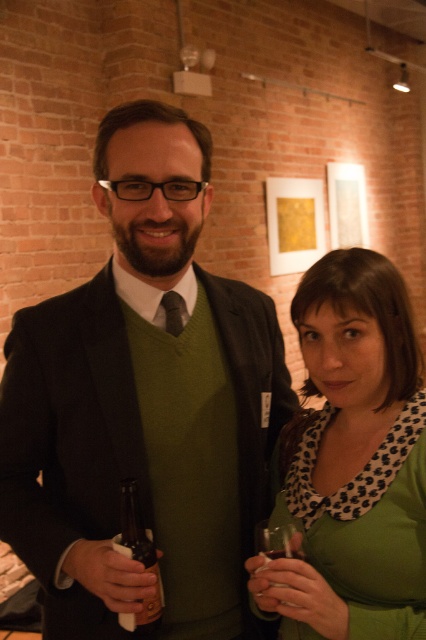
Is green matte sweater at center taller than clear glass at right?

Indeed, green matte sweater at center has a greater height compared to clear glass at right.

Does green matte sweater at center have a lesser width compared to clear glass at right?

No.

Locate an element on the screen. Image resolution: width=426 pixels, height=640 pixels. green matte sweater at center is located at coordinates (143, 403).

You are a GUI agent. You are given a task and a screenshot of the screen. Output one action in this format:
    pyautogui.click(x=<x>, y=<y>)
    Task: Click on the green matte sweater at center
    This screenshot has height=640, width=426.
    Given the screenshot: What is the action you would take?
    pyautogui.click(x=143, y=403)

Can you confirm if matte green blouse at center is smaller than clear glass at right?

No, matte green blouse at center is not smaller than clear glass at right.

Find the location of a particular element. matte green blouse at center is located at coordinates (354, 460).

Who is more distant from viewer, (386, 496) or (287, 602)?

The point (386, 496) is more distant.

Find the location of `matte green blouse at center`. matte green blouse at center is located at coordinates click(354, 460).

Which is above, green matte sweater at center or matte green blouse at center?

green matte sweater at center

Which is behind, point (239, 298) or point (406, 625)?

The point (239, 298) is more distant.

In order to click on green matte sweater at center in this screenshot , I will do `click(143, 403)`.